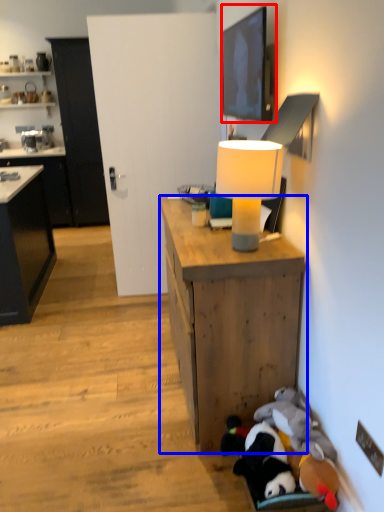
Question: Which object is further to the camera taking this photo, picture frame (highlighted by a red box) or desk (highlighted by a blue box)?

Choices:
 (A) picture frame
 (B) desk

Answer: (A)